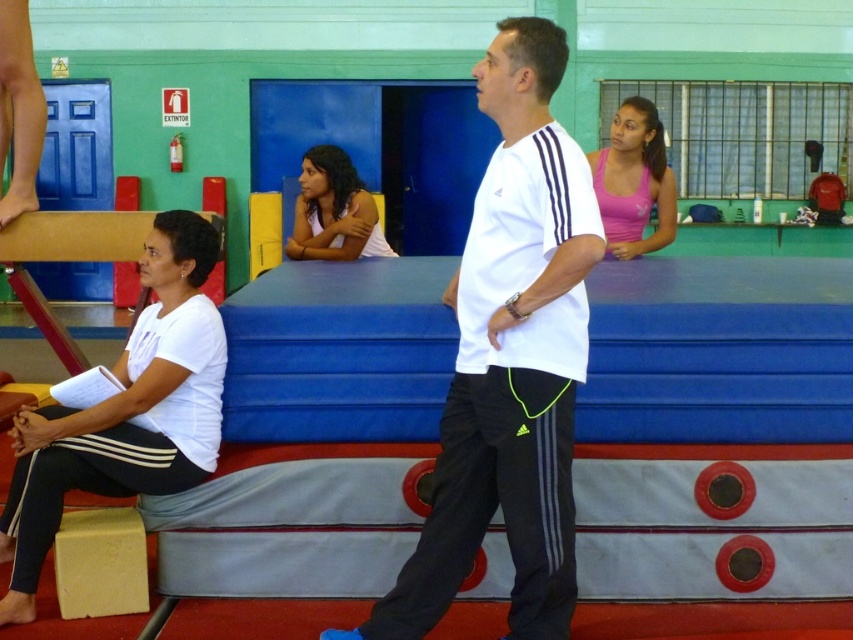
You are standing at the entrance of the gymnasium and see the white matte shirt at center. If you walk directly towards it, will you first pass the woman sitting on the beige block to your left?

The white matte shirt at center is located at point (509, 358). Since the woman is seated to the left of the man in the foreground, the path towards the shirt would pass the woman first before reaching the shirt.

You are a photographer setting up for a group photo in the gymnasium. You need to position two subjects wearing white matte shirts so that one appears taller than the other in the final shot. Given the current setup where the white matte shirt at center and the white matte shirt at left are present, which subject should you place closer to the camera to achieve this effect?

To make the white matte shirt at center appear taller than the white matte shirt at left, position the white matte shirt at center closer to the camera. Since objects closer to the camera appear larger in the photo, this placement will create the desired effect of the white matte shirt at center being much taller as mentioned in the description.